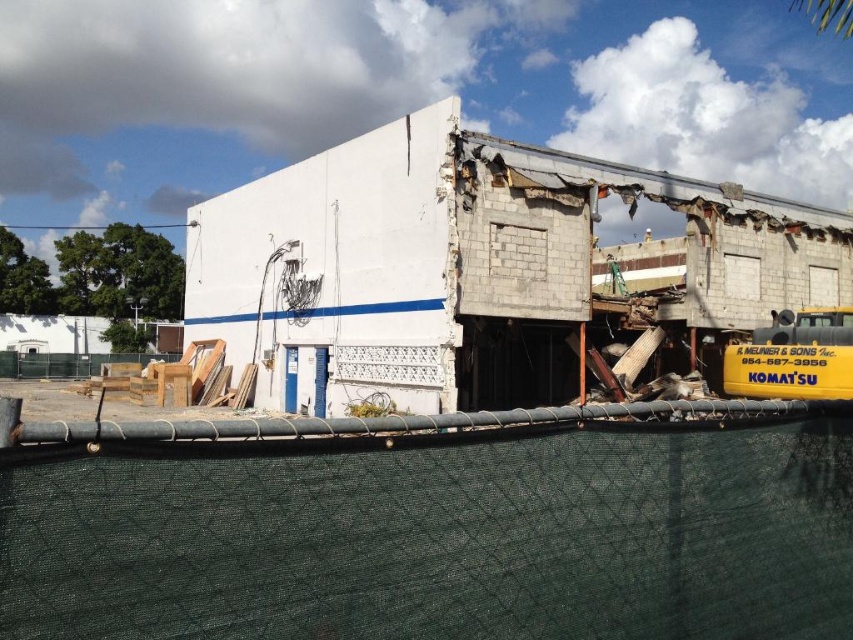
Question: Does white concrete building at center appear on the left side of yellow matte school bus at right?

Choices:
 (A) no
 (B) yes

Answer: (A)

Question: Which point is farther to the camera?

Choices:
 (A) (358, 184)
 (B) (822, 323)

Answer: (A)

Question: Does white concrete building at center have a larger size compared to yellow matte school bus at right?

Choices:
 (A) no
 (B) yes

Answer: (B)

Question: Does white concrete building at center have a larger size compared to yellow matte school bus at right?

Choices:
 (A) yes
 (B) no

Answer: (A)